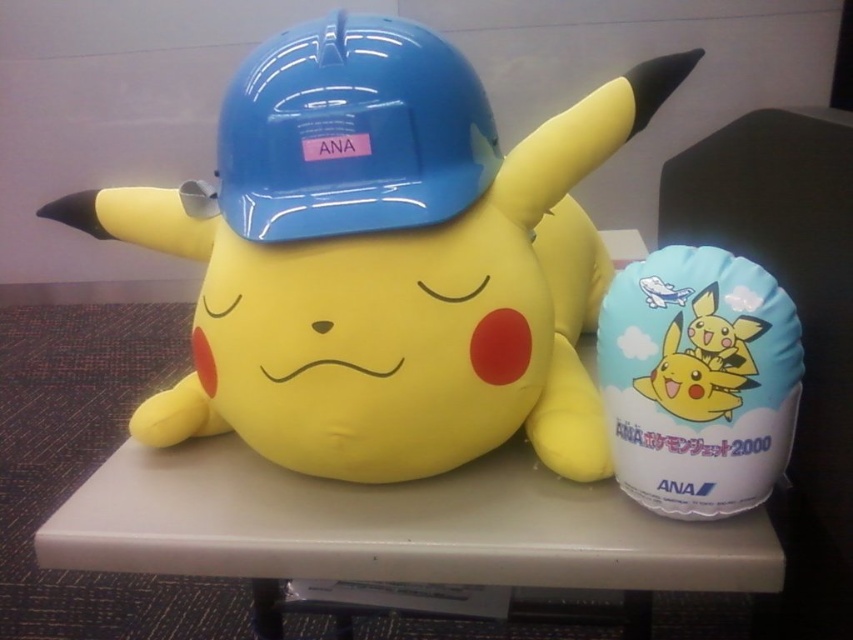
Who is more forward, (141, 518) or (358, 115)?

Point (358, 115)

Which is behind, point (228, 525) or point (405, 44)?

The point (228, 525) is more distant.

Does point (215, 502) lie behind point (248, 74)?

Yes, point (215, 502) is behind point (248, 74).

Locate an element on the screen. The height and width of the screenshot is (640, 853). white matte table at center is located at coordinates (392, 525).

Is matte plastic pikachu at center taller than blue hard hat at center?

Indeed, matte plastic pikachu at center has a greater height compared to blue hard hat at center.

Which is below, matte plastic pikachu at center or blue hard hat at center?

matte plastic pikachu at center is below.

Locate an element on the screen. matte plastic pikachu at center is located at coordinates (386, 259).

Locate an element on the screen. matte plastic pikachu at center is located at coordinates (386, 259).

Is matte plastic pikachu at center closer to the viewer compared to white matte table at center?

That is False.

Between matte plastic pikachu at center and white matte table at center, which one is positioned higher?

Positioned higher is matte plastic pikachu at center.

The width and height of the screenshot is (853, 640). I want to click on matte plastic pikachu at center, so click(x=386, y=259).